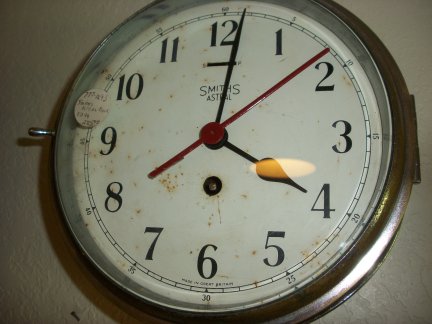
Identify the location of hinge. The height and width of the screenshot is (324, 432). (411, 95), (417, 180).